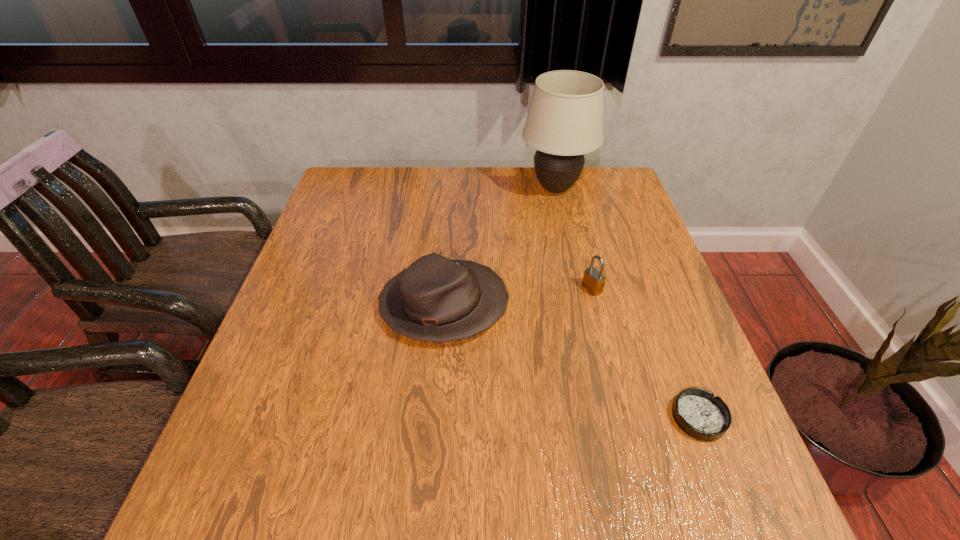
This screenshot has height=540, width=960. I want to click on free space between the shortest object and the padlock, so click(x=645, y=353).

You are a GUI agent. You are given a task and a screenshot of the screen. Output one action in this format:
    pyautogui.click(x=<x>, y=<y>)
    Task: Click on the free space between the nearest object and the leftmost object
    
    Given the screenshot: What is the action you would take?
    pyautogui.click(x=571, y=362)

Where is `free space between the padlock and the hat`? The height and width of the screenshot is (540, 960). free space between the padlock and the hat is located at coordinates (518, 297).

Locate an element on the screen. vacant area that lies between the rightmost object and the tallest object is located at coordinates [627, 303].

You are a GUI agent. You are given a task and a screenshot of the screen. Output one action in this format:
    pyautogui.click(x=<x>, y=<y>)
    Task: Click on the free space between the ashtray and the padlock
    The width and height of the screenshot is (960, 540).
    Given the screenshot: What is the action you would take?
    pyautogui.click(x=645, y=353)

The width and height of the screenshot is (960, 540). Identify the location of empty space between the padlock and the nearest object. (645, 353).

Image resolution: width=960 pixels, height=540 pixels. I want to click on free point between the shortest object and the padlock, so point(645,353).

What are the coordinates of `vacant area between the nearest object and the tallest object` in the screenshot? It's located at (627, 303).

Image resolution: width=960 pixels, height=540 pixels. Find the location of `free spot between the lampshade and the leftmost object`. free spot between the lampshade and the leftmost object is located at coordinates (499, 247).

Identify which object is the second closest to the leftmost object. Please provide its 2D coordinates. Your answer should be formatted as a tuple, i.e. [(x, y)], where the tuple contains the x and y coordinates of a point satisfying the conditions above.

[(565, 118)]